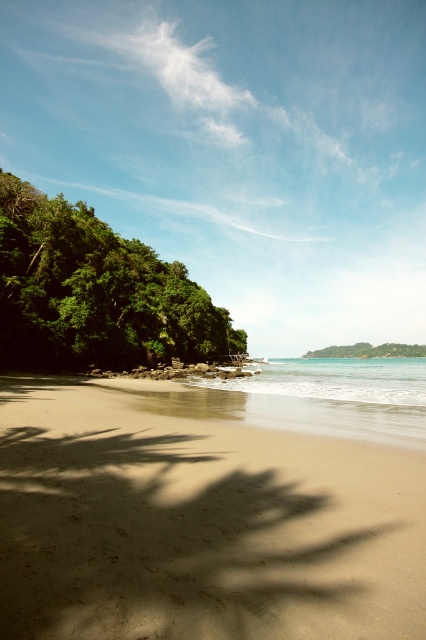
You are standing on the beach and see the green leafy tree at left and the green leafy tree at center. Which tree is closer to the ocean?

The green leafy tree at center is closer to the ocean because it is positioned to the right of the green leafy tree at left, which is further away from the shoreline.

You are standing at the center of the beach looking towards the ocean. Where is the green leafy tree at left located relative to your position?

The green leafy tree at left is located to the left side of the beach, positioned at coordinates approximately 0.458 on the x and 0.223 on the y axis, which places it to your left when facing the ocean.

You are standing on the beach and want to take a photo that includes both the green leafy tree at left and the clear blue water at center. Which object should you position closer to the edge of the frame to ensure both are fully visible?

Since the green leafy tree at left is smaller than the clear blue water at center, you should position the green leafy tree at left closer to the edge of the frame to ensure both are fully visible.